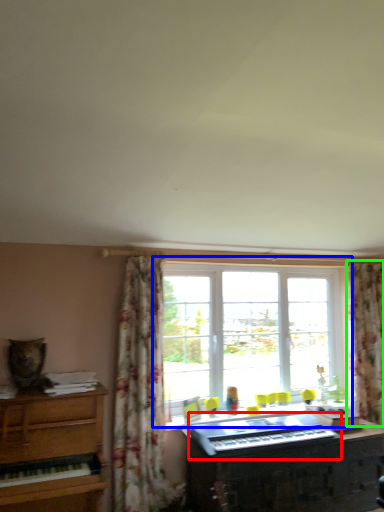
Question: Based on their relative distances, which object is nearer to musical keyboard (highlighted by a red box)? Choose from window (highlighted by a blue box) and curtain (highlighted by a green box).

Choices:
 (A) window
 (B) curtain

Answer: (A)